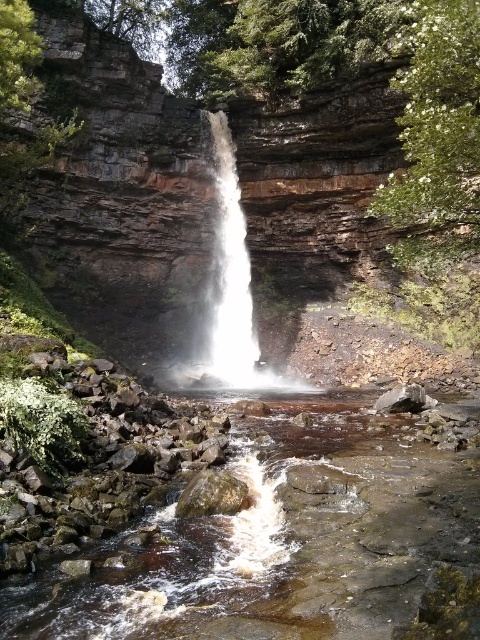
Does brown rocky stream at center lie in front of white frothy water at center?

Yes, brown rocky stream at center is in front of white frothy water at center.

Looking at this image, measure the distance from brown rocky stream at center to white frothy water at center.

brown rocky stream at center and white frothy water at center are 22.42 meters apart from each other.

Does point (51, 628) come behind point (220, 204)?

No, (51, 628) is in front of (220, 204).

Image resolution: width=480 pixels, height=640 pixels. I want to click on brown rocky stream at center, so click(280, 545).